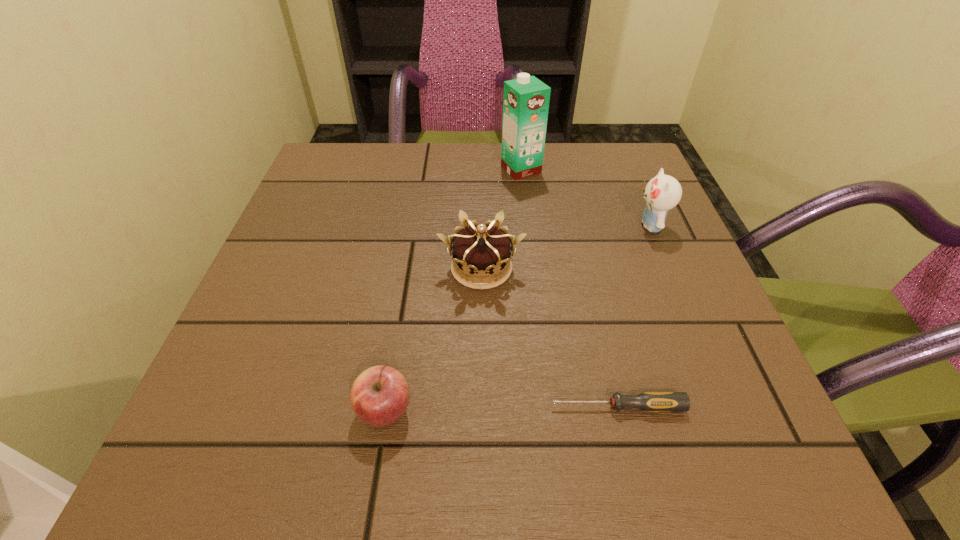
Find the location of a particular element. The image size is (960, 540). vacant space located on the front-facing side of the rightmost object is located at coordinates (454, 225).

Locate an element on the screen. The width and height of the screenshot is (960, 540). vacant position located on the right of the crown is located at coordinates (674, 268).

Locate an element on the screen. The image size is (960, 540). vacant area located 0.390m on the right of the leftmost object is located at coordinates (689, 411).

The width and height of the screenshot is (960, 540). Find the location of `vacant space located insert the screwdriver into a screw head`. vacant space located insert the screwdriver into a screw head is located at coordinates (354, 407).

I want to click on free space located insert the screwdriver into a screw head, so click(x=291, y=407).

At what (x,y) coordinates should I click in order to perform the action: click on vacant space located insert the screwdriver into a screw head. Please return your answer as a coordinate pair (x, y). Looking at the image, I should click on (473, 407).

Locate an element on the screen. This screenshot has width=960, height=540. object that is positioned at the far edge is located at coordinates (526, 99).

Find the location of a particular element. object that is at the near edge is located at coordinates (379, 396).

At what (x,y) coordinates should I click in order to perform the action: click on kitten located at the right edge. Please return your answer as a coordinate pair (x, y). Looking at the image, I should click on (662, 193).

You are a GUI agent. You are given a task and a screenshot of the screen. Output one action in this format:
    pyautogui.click(x=<x>, y=<y>)
    Task: Click on the screwdriver that is positioned at the right edge
    Image resolution: width=960 pixels, height=540 pixels.
    Given the screenshot: What is the action you would take?
    pyautogui.click(x=648, y=401)